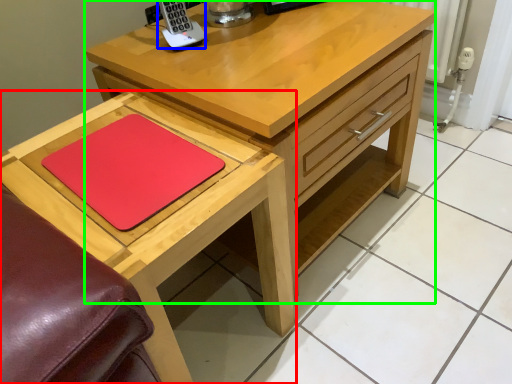
Question: Based on their relative distances, which object is nearer to table (highlighted by a red box)? Choose from appliance (highlighted by a blue box) and chest of drawers (highlighted by a green box).

Choices:
 (A) appliance
 (B) chest of drawers

Answer: (B)